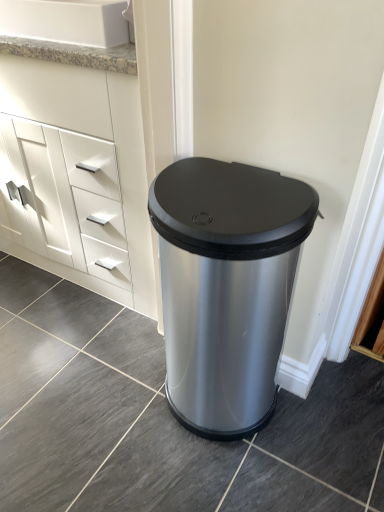
Question: From the image's perspective, would you say white granite sink at upper left is positioned over white matte cabinet at left?

Choices:
 (A) no
 (B) yes

Answer: (B)

Question: From a real-world perspective, is white granite sink at upper left located beneath white matte cabinet at left?

Choices:
 (A) yes
 (B) no

Answer: (B)

Question: Can you confirm if white granite sink at upper left is wider than white matte cabinet at left?

Choices:
 (A) no
 (B) yes

Answer: (A)

Question: From the image's perspective, is white granite sink at upper left below white matte cabinet at left?

Choices:
 (A) no
 (B) yes

Answer: (A)

Question: Is white granite sink at upper left further to camera compared to white matte cabinet at left?

Choices:
 (A) no
 (B) yes

Answer: (B)

Question: Would you say white matte cabinet at left is to the left or to the right of satin silver trash can at center in the picture?

Choices:
 (A) right
 (B) left

Answer: (B)

Question: From a real-world perspective, relative to satin silver trash can at center, is white matte cabinet at left vertically above or below?

Choices:
 (A) above
 (B) below

Answer: (A)

Question: Is white matte cabinet at left in front of or behind satin silver trash can at center in the image?

Choices:
 (A) behind
 (B) front

Answer: (A)

Question: Is white matte cabinet at left inside the boundaries of satin silver trash can at center, or outside?

Choices:
 (A) outside
 (B) inside

Answer: (A)

Question: Looking at their shapes, would you say satin silver trash can at center is wider or thinner than white matte cabinet at left?

Choices:
 (A) thin
 (B) wide

Answer: (A)

Question: Relative to white matte cabinet at left, is satin silver trash can at center in front or behind?

Choices:
 (A) front
 (B) behind

Answer: (A)

Question: From the image's perspective, is satin silver trash can at center positioned above or below white matte cabinet at left?

Choices:
 (A) below
 (B) above

Answer: (A)

Question: In terms of size, does satin silver trash can at center appear bigger or smaller than white matte cabinet at left?

Choices:
 (A) small
 (B) big

Answer: (A)

Question: Choose the correct answer: Is white granite sink at upper left inside white matte cabinet at left or outside it?

Choices:
 (A) outside
 (B) inside

Answer: (A)

Question: From the image's perspective, is white granite sink at upper left positioned above or below white matte cabinet at left?

Choices:
 (A) above
 (B) below

Answer: (A)